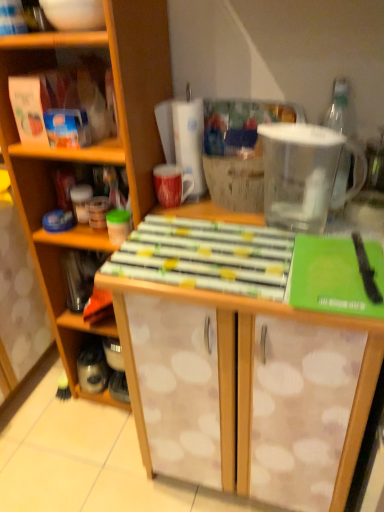
Question: Is white dotted wood cabinet at center surrounding metallic silver container at left?

Choices:
 (A) yes
 (B) no

Answer: (A)

Question: Can you confirm if white dotted wood cabinet at center is thinner than metallic silver container at left?

Choices:
 (A) no
 (B) yes

Answer: (A)

Question: From the image's perspective, is white dotted wood cabinet at center over metallic silver container at left?

Choices:
 (A) yes
 (B) no

Answer: (A)

Question: Does white dotted wood cabinet at center have a lesser height compared to metallic silver container at left?

Choices:
 (A) no
 (B) yes

Answer: (A)

Question: Considering the relative sizes of white dotted wood cabinet at center and metallic silver container at left in the image provided, is white dotted wood cabinet at center wider than metallic silver container at left?

Choices:
 (A) no
 (B) yes

Answer: (B)

Question: Do you think white dotted wood cabinet at center is within wooden table at center, or outside of it?

Choices:
 (A) inside
 (B) outside

Answer: (B)

Question: Considering their positions, is white dotted wood cabinet at center located in front of or behind wooden table at center?

Choices:
 (A) front
 (B) behind

Answer: (B)

Question: In the image, is white dotted wood cabinet at center on the left side or the right side of wooden table at center?

Choices:
 (A) right
 (B) left

Answer: (B)

Question: From a real-world perspective, relative to wooden table at center, is white dotted wood cabinet at center vertically above or below?

Choices:
 (A) above
 (B) below

Answer: (A)

Question: From a real-world perspective, relative to white dotted wood cabinet at center, is wooden table at center vertically above or below?

Choices:
 (A) above
 (B) below

Answer: (B)

Question: From their relative heights in the image, would you say wooden table at center is taller or shorter than white dotted wood cabinet at center?

Choices:
 (A) tall
 (B) short

Answer: (B)

Question: Which is correct: wooden table at center is inside white dotted wood cabinet at center, or outside of it?

Choices:
 (A) inside
 (B) outside

Answer: (B)

Question: Looking at their shapes, would you say wooden table at center is wider or thinner than white dotted wood cabinet at center?

Choices:
 (A) thin
 (B) wide

Answer: (B)

Question: Considering the relative positions of transparent plastic pitcher at upper right and metallic silver container at left in the image provided, is transparent plastic pitcher at upper right to the left or to the right of metallic silver container at left?

Choices:
 (A) right
 (B) left

Answer: (A)

Question: Is transparent plastic pitcher at upper right taller or shorter than metallic silver container at left?

Choices:
 (A) short
 (B) tall

Answer: (B)